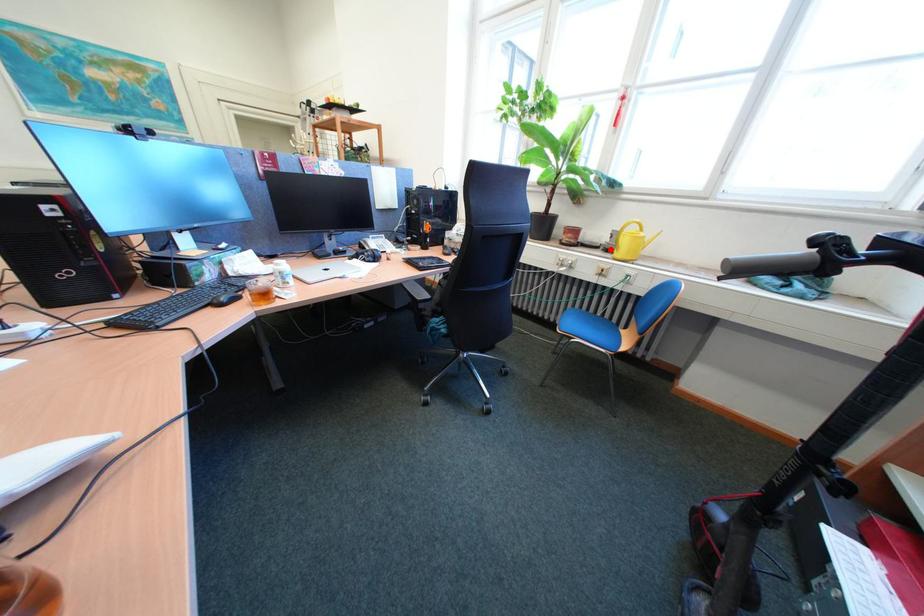
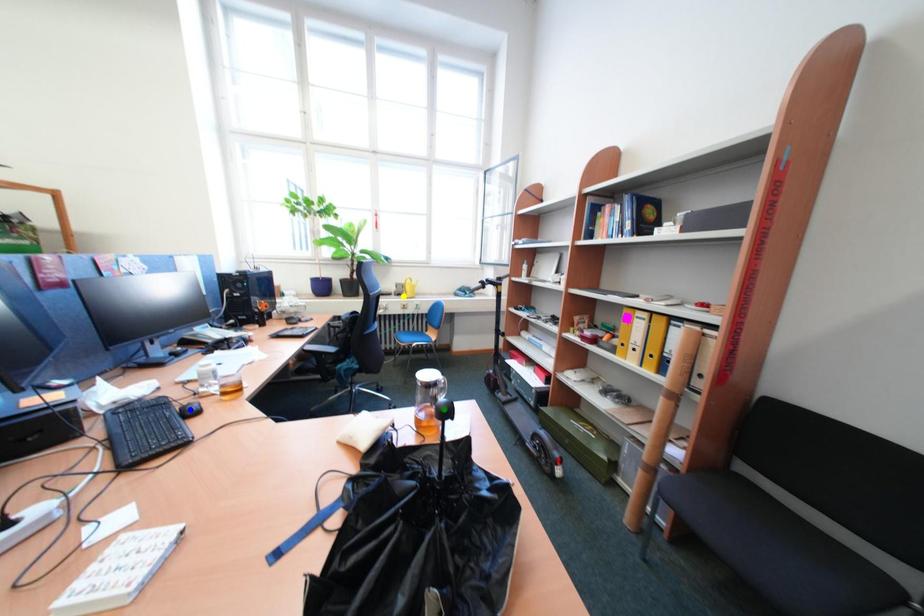
Question: I am providing you with two images of the same scene from different viewpoints. A red point is marked on the first image. You are given multiple points on the second image. Which mark in image 2 goes with the point in image 1?

Choices:
 (A) yellow point
 (B) green point
 (C) blue point

Answer: (A)